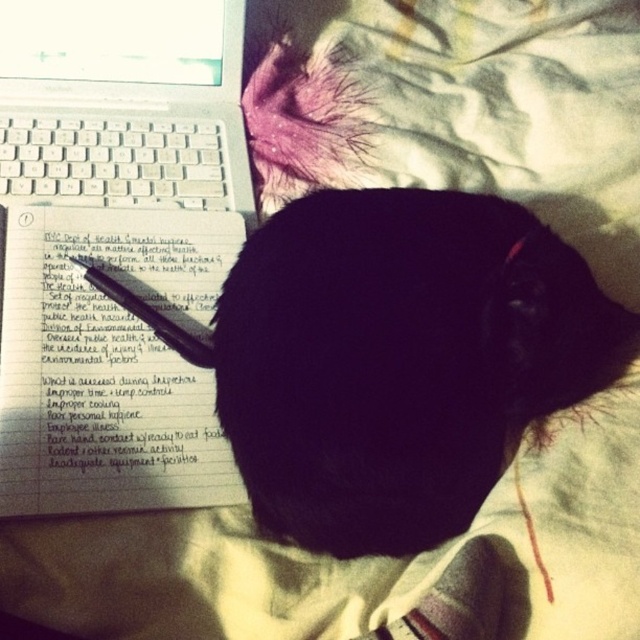
You are looking at the image and want to determine which of the two points, point (19,371) or point (193,340), is nearer to you. Based on the scene description, which point is closer?

Point (19,371) is closer to the viewer than point (193,340).

Where is the black fur cat at center located in the image?

The black fur cat at center is located at point coordinates of [401,360].